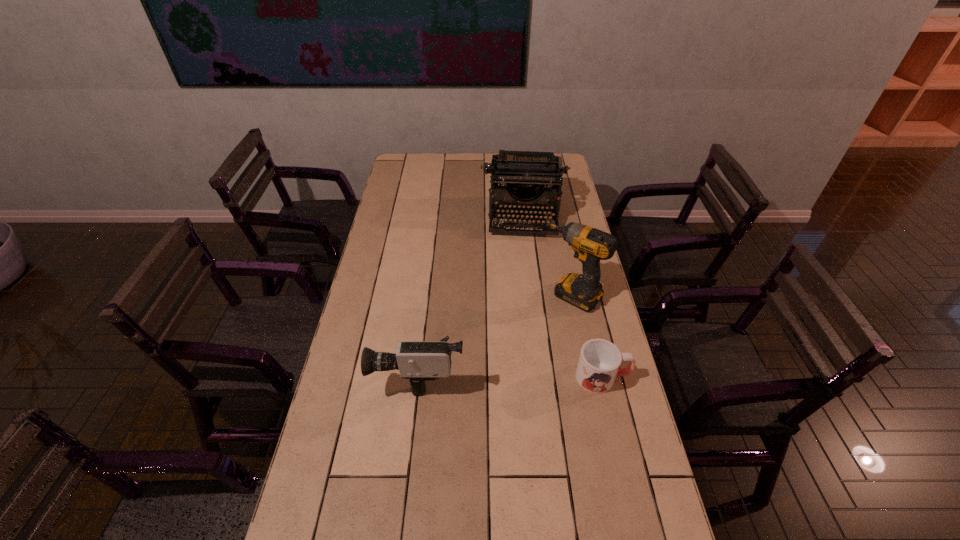
Identify the location of free spot located on the typing side of the farthest object. (524, 285).

The image size is (960, 540). What are the coordinates of `free spot located on the typing side of the farthest object` in the screenshot? It's located at (524, 305).

Where is `vacant space located 0.280m on the typing side of the farthest object`? This screenshot has height=540, width=960. vacant space located 0.280m on the typing side of the farthest object is located at coordinates (524, 287).

The height and width of the screenshot is (540, 960). Find the location of `object that is at the left edge`. object that is at the left edge is located at coordinates (417, 361).

Where is `mug located in the right edge section of the desktop`? This screenshot has width=960, height=540. mug located in the right edge section of the desktop is located at coordinates (599, 361).

Identify the location of drill positioned at the right edge. (584, 291).

Locate an element on the screen. typewriter that is at the right edge is located at coordinates (524, 172).

Where is `free region at the far edge of the desktop`? free region at the far edge of the desktop is located at coordinates pyautogui.click(x=446, y=172).

Image resolution: width=960 pixels, height=540 pixels. Find the location of `free space at the near edge of the desktop`. free space at the near edge of the desktop is located at coordinates (546, 513).

Identify the location of vacant space at the left edge. The height and width of the screenshot is (540, 960). (325, 456).